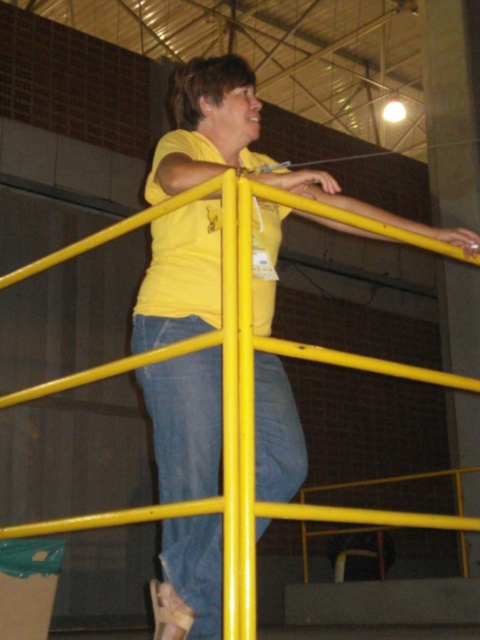
Between point (201, 627) and point (176, 442), which one is positioned behind?

The point (201, 627) is behind.

Which is more to the left, yellow matte shirt at upper center or denim at center?

denim at center is more to the left.

What do you see at coordinates (245, 147) in the screenshot? I see `yellow matte shirt at upper center` at bounding box center [245, 147].

Find the location of `yellow matte shirt at upper center`. yellow matte shirt at upper center is located at coordinates (245, 147).